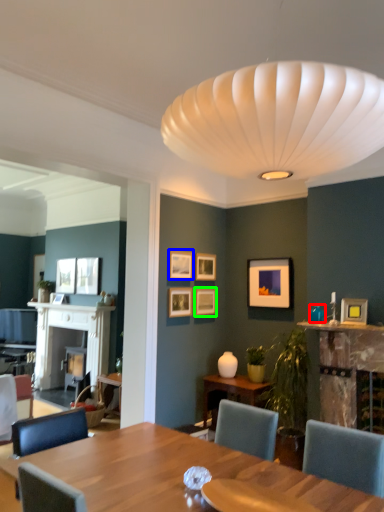
Question: Which object is the closest to the teal (highlighted by a red box)? Choose among these: picture frame (highlighted by a blue box) or picture frame (highlighted by a green box).

Choices:
 (A) picture frame
 (B) picture frame

Answer: (B)